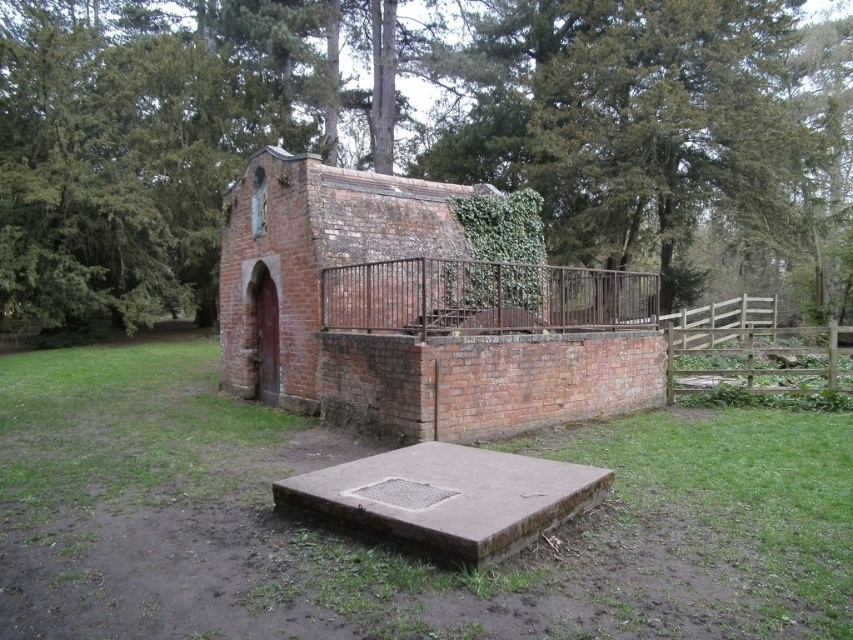
Question: Which point is closer to the camera?

Choices:
 (A) brick chapel at center
 (B) green leafy tree at upper center
 (C) wooden gate at right
 (D) rusty metal fence at center

Answer: (D)

Question: Is brick chapel at center positioned behind wooden gate at right?

Choices:
 (A) yes
 (B) no

Answer: (A)

Question: Among these objects, which one is farthest from the camera?

Choices:
 (A) brick chapel at center
 (B) wooden gate at right

Answer: (A)

Question: Does green leafy tree at upper center lie in front of rusty metal fence at center?

Choices:
 (A) yes
 (B) no

Answer: (B)

Question: Which point is farther to the camera?

Choices:
 (A) green leafy tree at upper center
 (B) brick chapel at center
 (C) wooden gate at right

Answer: (B)

Question: Does green leafy tree at upper center appear on the right side of rusty metal fence at center?

Choices:
 (A) yes
 (B) no

Answer: (A)